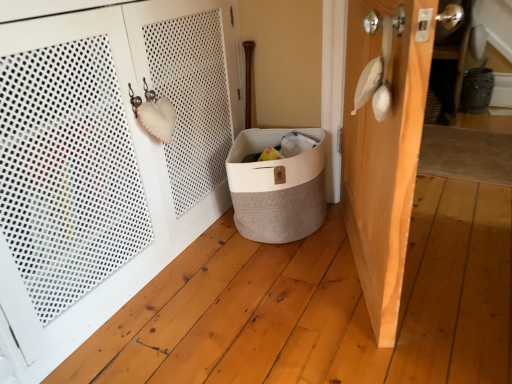
The image size is (512, 384). Describe the element at coordinates (276, 187) in the screenshot. I see `beige woven laundry basket at center` at that location.

Identify the location of wooden door at right, acting as the first door starting from the right. (384, 154).

Is beige woven laundry basket at center looking in the opposite direction of white woven basket at lower right, placed as the 1th door when sorted from left to right?

No, white woven basket at lower right, placed as the 1th door when sorted from left to right, is not at the back of beige woven laundry basket at center.

Is beige woven laundry basket at center situated inside white woven basket at lower right, which ranks as the 2th door in right-to-left order, or outside?

beige woven laundry basket at center is outside white woven basket at lower right, which ranks as the 2th door in right-to-left order.

How many degrees apart are the facing directions of beige woven laundry basket at center and white woven basket at lower right, placed as the 1th door when sorted from left to right?

The angular difference between beige woven laundry basket at center and white woven basket at lower right, placed as the 1th door when sorted from left to right, is 64.5 degrees.

Between beige woven laundry basket at center and white woven basket at lower right, which ranks as the 2th door in right-to-left order, which one has smaller size?

beige woven laundry basket at center.

Is wooden door at right, placed as the 2th door when sorted from left to right, to the left or to the right of beige woven laundry basket at center in the image?

wooden door at right, placed as the 2th door when sorted from left to right, is to the right of beige woven laundry basket at center.

Is point (414, 44) closer or farther from the camera than point (252, 233)?

Point (414, 44).

At what (x,y) coordinates should I click in order to perform the action: click on laundry basket directly beneath the wooden door at right, placed as the 2th door when sorted from left to right (from a real-world perspective). Please return your answer as a coordinate pair (x, y). Image resolution: width=512 pixels, height=384 pixels. Looking at the image, I should click on (276, 187).

From the image's perspective, which is below, wooden door at right, acting as the first door starting from the right, or beige woven laundry basket at center?

beige woven laundry basket at center, from the image's perspective.

Considering the relative sizes of white woven basket at lower right, placed as the 1th door when sorted from left to right, and beige woven laundry basket at center in the image provided, is white woven basket at lower right, placed as the 1th door when sorted from left to right, taller than beige woven laundry basket at center?

Yes, white woven basket at lower right, placed as the 1th door when sorted from left to right, is taller than beige woven laundry basket at center.

From a real-world perspective, who is located higher, white woven basket at lower right, which ranks as the 2th door in right-to-left order, or beige woven laundry basket at center?

white woven basket at lower right, which ranks as the 2th door in right-to-left order.

Is white woven basket at lower right, which ranks as the 2th door in right-to-left order, at the right side of beige woven laundry basket at center?

No.

Can you confirm if wooden door at right, acting as the first door starting from the right, is positioned to the left of white woven basket at lower right, which ranks as the 2th door in right-to-left order?

In fact, wooden door at right, acting as the first door starting from the right, is to the right of white woven basket at lower right, which ranks as the 2th door in right-to-left order.

Does wooden door at right, placed as the 2th door when sorted from left to right, come behind white woven basket at lower right, which ranks as the 2th door in right-to-left order?

Yes, it is.

Which of these two, wooden door at right, placed as the 2th door when sorted from left to right, or white woven basket at lower right, placed as the 1th door when sorted from left to right, is thinner?

Thinner between the two is wooden door at right, placed as the 2th door when sorted from left to right.

Is wooden door at right, placed as the 2th door when sorted from left to right, outside of white woven basket at lower right, which ranks as the 2th door in right-to-left order?

Yes, wooden door at right, placed as the 2th door when sorted from left to right, is not within white woven basket at lower right, which ranks as the 2th door in right-to-left order.

Can you confirm if beige woven laundry basket at center is shorter than wooden door at right, placed as the 2th door when sorted from left to right?

Yes, beige woven laundry basket at center is shorter than wooden door at right, placed as the 2th door when sorted from left to right.

From the image's perspective, which is below, beige woven laundry basket at center or wooden door at right, placed as the 2th door when sorted from left to right?

beige woven laundry basket at center appears lower in the image.

From the picture: Is wooden door at right, acting as the first door starting from the right, at the back of beige woven laundry basket at center?

That's not correct — beige woven laundry basket at center is not looking away from wooden door at right, acting as the first door starting from the right.

Can you tell me how much beige woven laundry basket at center and wooden door at right, acting as the first door starting from the right, differ in facing direction?

The angular difference between beige woven laundry basket at center and wooden door at right, acting as the first door starting from the right, is 89.4 degrees.

What's the angular difference between white woven basket at lower right, which ranks as the 2th door in right-to-left order, and wooden door at right, placed as the 2th door when sorted from left to right,'s facing directions?

white woven basket at lower right, which ranks as the 2th door in right-to-left order, and wooden door at right, placed as the 2th door when sorted from left to right, are facing 154 degrees away from each other.

Between white woven basket at lower right, which ranks as the 2th door in right-to-left order, and wooden door at right, placed as the 2th door when sorted from left to right, which one appears on the left side from the viewer's perspective?

From the viewer's perspective, white woven basket at lower right, which ranks as the 2th door in right-to-left order, appears more on the left side.

Based on their sizes in the image, would you say white woven basket at lower right, placed as the 1th door when sorted from left to right, is bigger or smaller than wooden door at right, placed as the 2th door when sorted from left to right?

Clearly, white woven basket at lower right, placed as the 1th door when sorted from left to right, is larger in size than wooden door at right, placed as the 2th door when sorted from left to right.

From the image's perspective, between white woven basket at lower right, which ranks as the 2th door in right-to-left order, and wooden door at right, placed as the 2th door when sorted from left to right, who is located below?

wooden door at right, placed as the 2th door when sorted from left to right.

Locate an element on the screen. The height and width of the screenshot is (384, 512). the 2nd door in front of the beige woven laundry basket at center, counting from the anchor's position is located at coordinates (105, 162).

You are a GUI agent. You are given a task and a screenshot of the screen. Output one action in this format:
    pyautogui.click(x=<x>, y=<y>)
    Task: Click on the laundry basket below the wooden door at right, acting as the first door starting from the right (from the image's perspective)
    The image size is (512, 384).
    Given the screenshot: What is the action you would take?
    tap(276, 187)

Estimate the real-world distances between objects in this image. Which object is closer to white woven basket at lower right, placed as the 1th door when sorted from left to right, wooden door at right, placed as the 2th door when sorted from left to right, or beige woven laundry basket at center?

beige woven laundry basket at center lies closer to white woven basket at lower right, placed as the 1th door when sorted from left to right, than the other object.

Which object lies further to the anchor point wooden door at right, placed as the 2th door when sorted from left to right, beige woven laundry basket at center or white woven basket at lower right, which ranks as the 2th door in right-to-left order?

Among the two, white woven basket at lower right, which ranks as the 2th door in right-to-left order, is located further to wooden door at right, placed as the 2th door when sorted from left to right.

From the image, which object appears to be nearer to wooden door at right, placed as the 2th door when sorted from left to right, white woven basket at lower right, placed as the 1th door when sorted from left to right, or beige woven laundry basket at center?

The object closer to wooden door at right, placed as the 2th door when sorted from left to right, is beige woven laundry basket at center.

When comparing their distances from beige woven laundry basket at center, does wooden door at right, acting as the first door starting from the right, or white woven basket at lower right, placed as the 1th door when sorted from left to right, seem closer?

Among the two, wooden door at right, acting as the first door starting from the right, is located nearer to beige woven laundry basket at center.

Which object lies further to the anchor point white woven basket at lower right, which ranks as the 2th door in right-to-left order, beige woven laundry basket at center or wooden door at right, acting as the first door starting from the right?

wooden door at right, acting as the first door starting from the right.

Estimate the real-world distances between objects in this image. Which object is closer to beige woven laundry basket at center, white woven basket at lower right, placed as the 1th door when sorted from left to right, or wooden door at right, placed as the 2th door when sorted from left to right?

wooden door at right, placed as the 2th door when sorted from left to right.

Where is `door between white woven basket at lower right, which ranks as the 2th door in right-to-left order, and beige woven laundry basket at center in the front-back direction`? The image size is (512, 384). door between white woven basket at lower right, which ranks as the 2th door in right-to-left order, and beige woven laundry basket at center in the front-back direction is located at coordinates tap(384, 154).